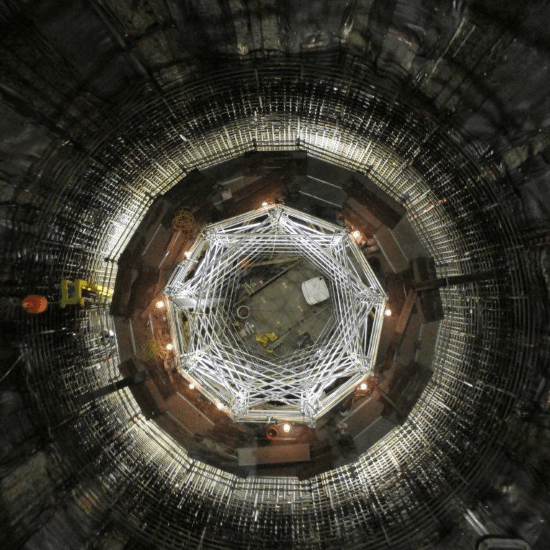
Where is `fridge`? fridge is located at coordinates (312, 293).